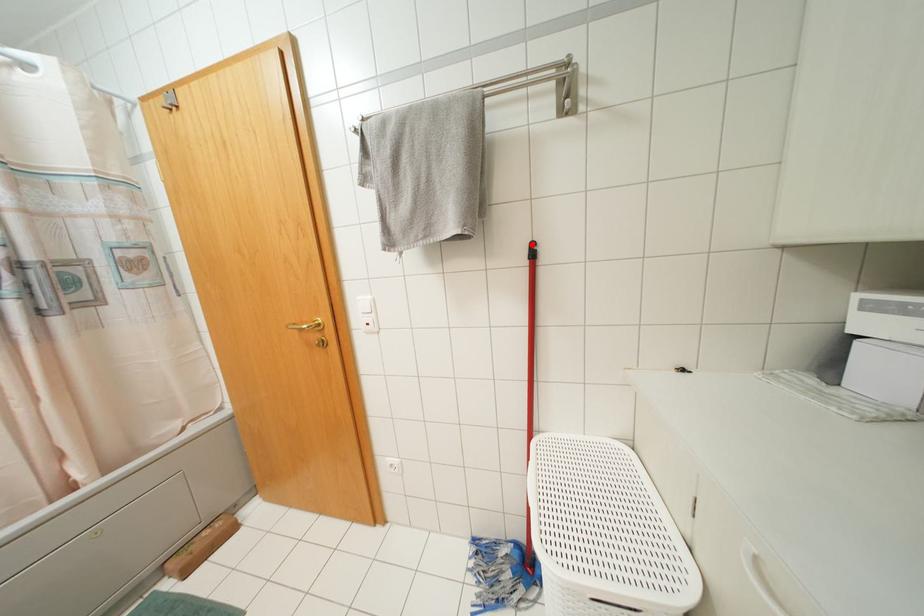
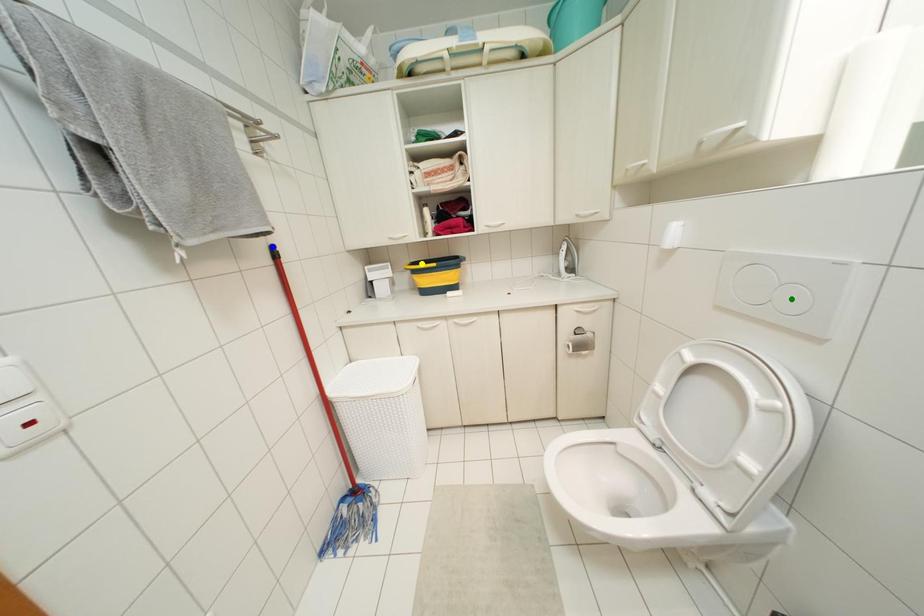
Question: I am providing you with two images of the same scene from different viewpoints. A red point is marked on the first image. You are given multiple points on the second image. Which point in image 2 is actually the same real-world point as the red point in image 1?

Choices:
 (A) green point
 (B) yellow point
 (C) blue point

Answer: (C)